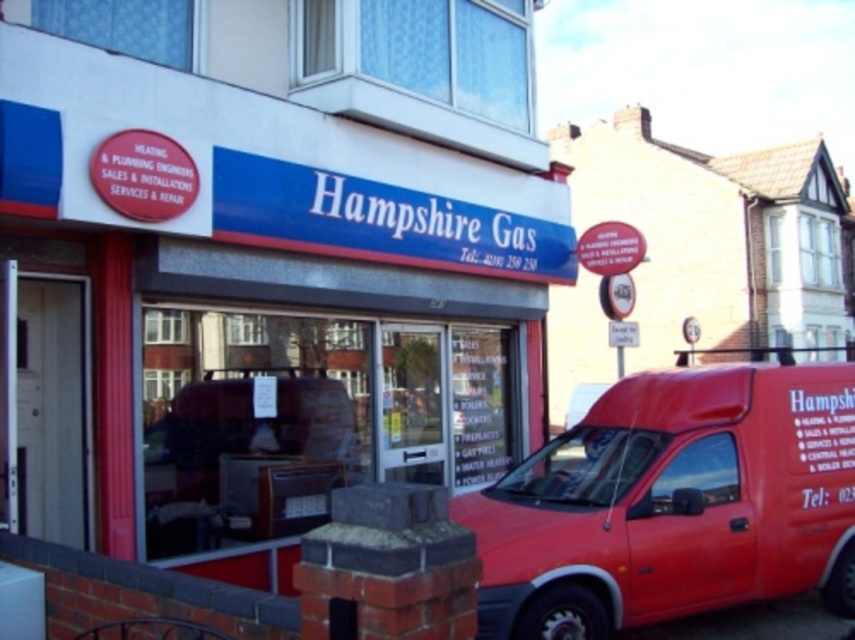
Question: Is matte blue signboard at center further to camera compared to metallic red van at center?

Choices:
 (A) yes
 (B) no

Answer: (A)

Question: Does matte blue signboard at center appear under metallic red van at center?

Choices:
 (A) yes
 (B) no

Answer: (B)

Question: From the image, what is the correct spatial relationship of matte blue signboard at center in relation to metallic red van at center?

Choices:
 (A) above
 (B) below

Answer: (A)

Question: Which point is closer to the camera?

Choices:
 (A) (545, 548)
 (B) (127, 216)

Answer: (A)